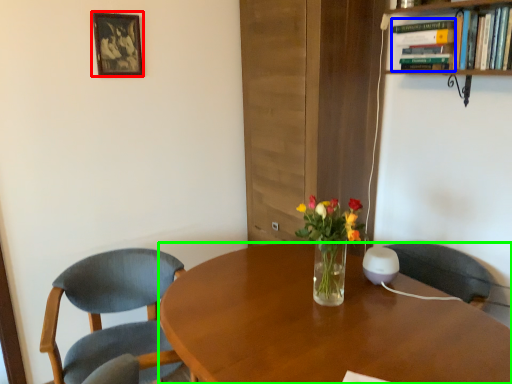
Question: Estimate the real-world distances between objects in this image. Which object is farther from picture frame (highlighted by a red box), book (highlighted by a blue box) or desk (highlighted by a green box)?

Choices:
 (A) book
 (B) desk

Answer: (B)